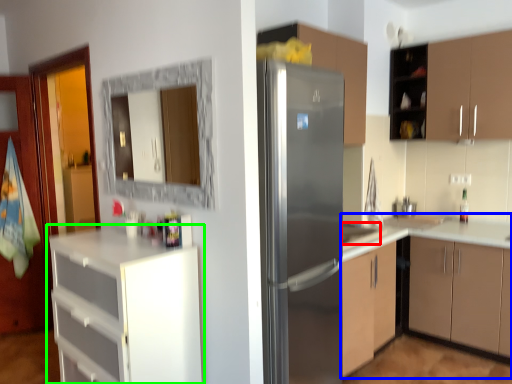
Question: Which object is the closest to the sink (highlighted by a red box)? Choose among these: cabinetry (highlighted by a blue box) or cabinetry (highlighted by a green box).

Choices:
 (A) cabinetry
 (B) cabinetry

Answer: (A)